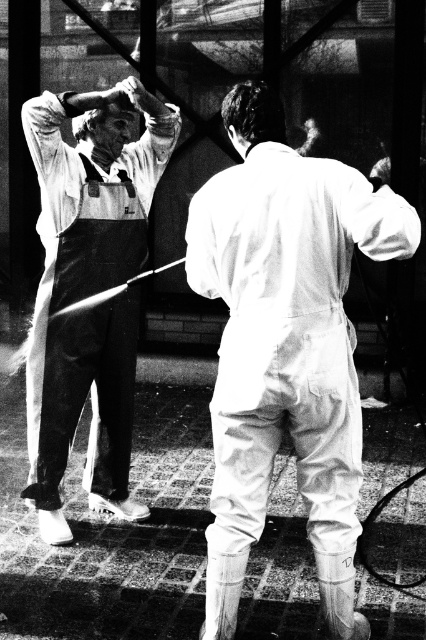
Does white matte jumpsuit at center appear under matte white overalls at left?

Yes.

Is white matte jumpsuit at center to the right of matte white overalls at left from the viewer's perspective?

Indeed, white matte jumpsuit at center is positioned on the right side of matte white overalls at left.

Describe the element at coordinates (285, 344) in the screenshot. I see `white matte jumpsuit at center` at that location.

At what (x,y) coordinates should I click in order to perform the action: click on white matte jumpsuit at center. Please return your answer as a coordinate pair (x, y). The image size is (426, 640). Looking at the image, I should click on (285, 344).